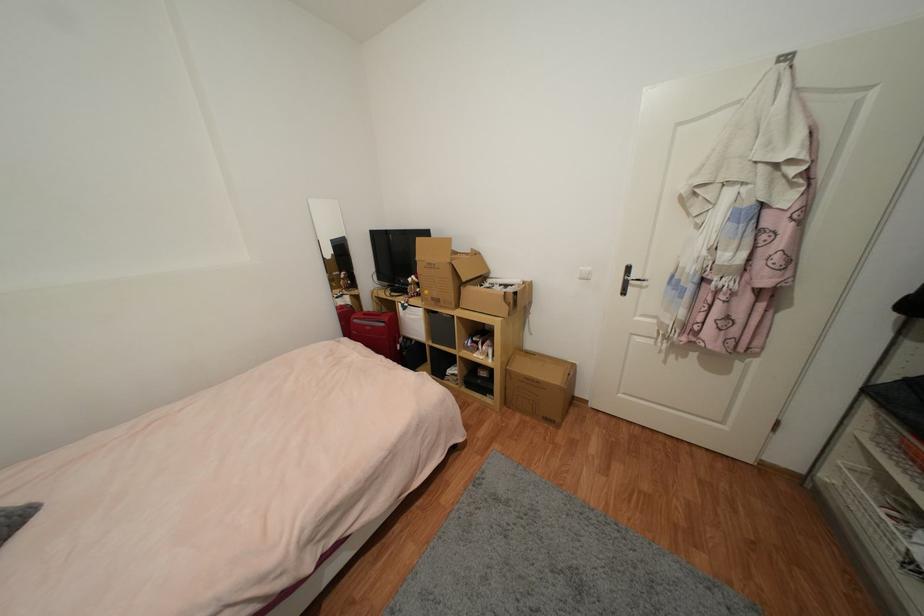
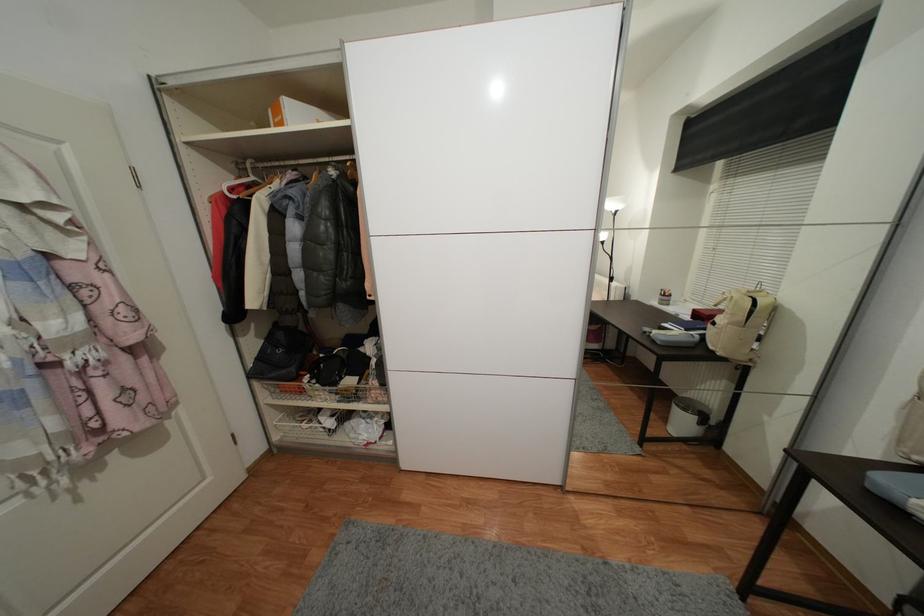
Based on the photo, the first image is from the beginning of the video and the second image is from the end. How did the camera likely rotate when shooting the video?

The camera's rotation is toward right-down.